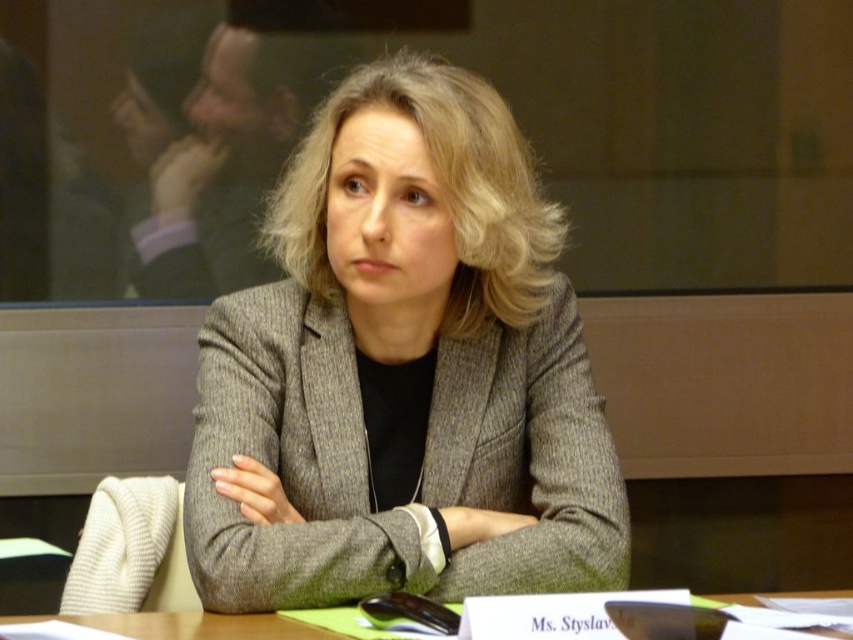
You are a photographer setting up for a group photo at the conference table. You need to position two markers at the coordinates point (387, 141) and point (207, 628). Which marker will appear closer to the camera in the final photo?

Point (387, 141) is further to the viewer than point (207, 628), so the marker at point (387, 141) will appear closer to the camera in the final photo.

You are organizing a small conference and need to ensure that all nameplates fit on the table. The gray textured blazer at center and the green felt placemat at center are both on the table. Which object has a greater width, and will the nameplate for Ms. Styslav fit if it requires 1.2 meters of space?

The gray textured blazer at center is wider than the green felt placemat at center. Since the nameplate requires 1.2 meters of space, we need to check if there is enough space on the table. However, the provided information does not specify the exact dimensions of the table or the objects beyond their relative widths. Therefore, it is unclear if the nameplate will fit based on the given details.